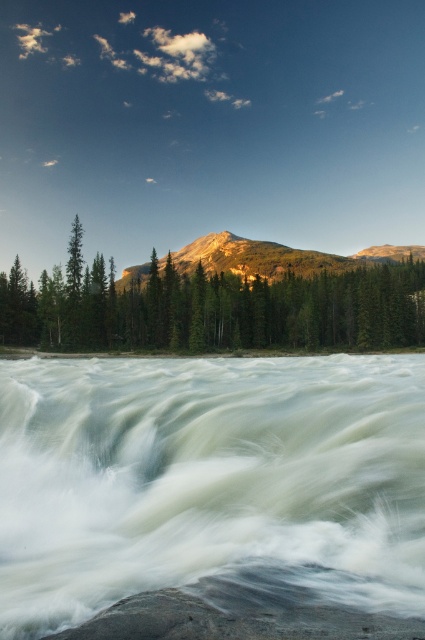
Question: Considering the relative positions of white frothy water at center and rocky brown mountain at center in the image provided, where is white frothy water at center located with respect to rocky brown mountain at center?

Choices:
 (A) below
 (B) above

Answer: (A)

Question: Can you confirm if white frothy water at center is positioned to the left of green matte tree at center?

Choices:
 (A) no
 (B) yes

Answer: (B)

Question: Which of the following is the closest to the observer?

Choices:
 (A) (204, 236)
 (B) (331, 461)
 (C) (37, 316)

Answer: (B)

Question: Can you confirm if white frothy water at center is positioned above rocky brown mountain at center?

Choices:
 (A) no
 (B) yes

Answer: (A)

Question: Which of the following is the farthest from the observer?

Choices:
 (A) white frothy water at center
 (B) rocky brown mountain at center

Answer: (B)

Question: Which object is closer to the camera taking this photo?

Choices:
 (A) green matte tree at center
 (B) white frothy water at center
 (C) rocky brown mountain at center

Answer: (B)